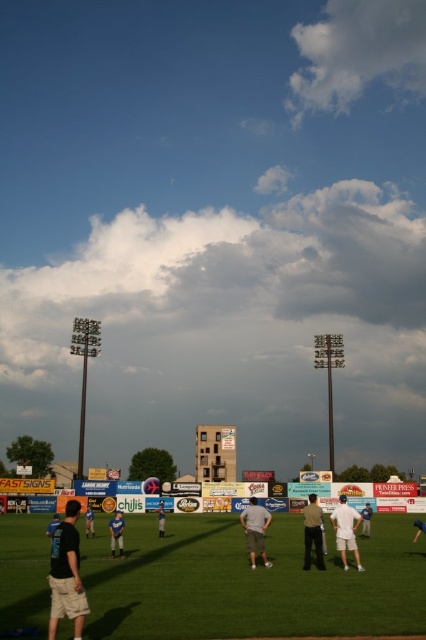
Question: Considering the relative positions of light gray fabric shorts at center and dark blue shirt at lower left in the image provided, where is light gray fabric shorts at center located with respect to dark blue shirt at lower left?

Choices:
 (A) right
 (B) left

Answer: (A)

Question: Which point appears farthest from the camera in this image?

Choices:
 (A) (310, 500)
 (B) (412, 541)

Answer: (A)

Question: Is dark blue uniform at lower left closer to camera compared to blue fabric glove at center?

Choices:
 (A) yes
 (B) no

Answer: (B)

Question: Which of these objects is positioned closest to the dark blue shirt at lower left?

Choices:
 (A) white cotton shirt at center
 (B) dark blue uniform at lower left

Answer: (B)

Question: Which of the following is the closest to the observer?

Choices:
 (A) (405, 582)
 (B) (115, 547)

Answer: (A)

Question: Can you confirm if white cotton shorts at center is positioned to the right of dark blue uniform at lower left?

Choices:
 (A) no
 (B) yes

Answer: (B)